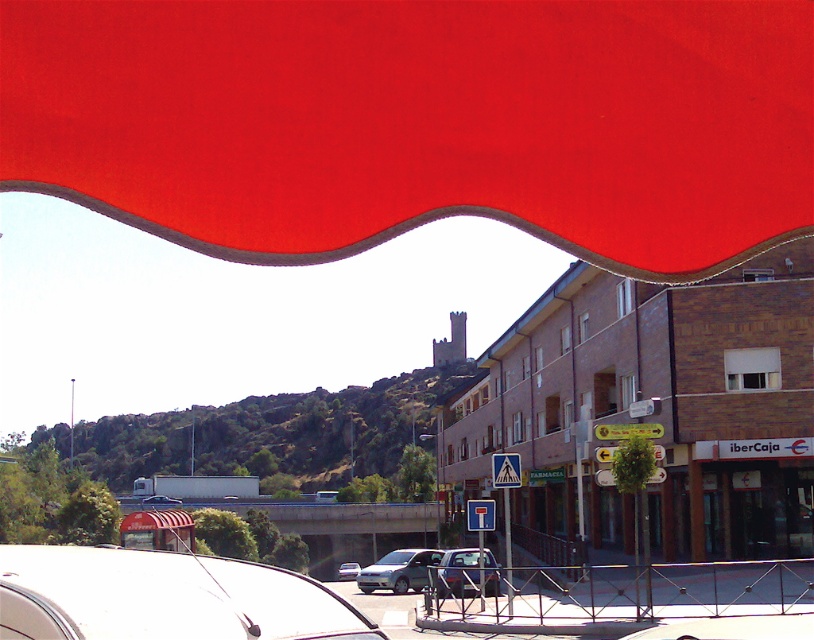
Question: Which point is farther to the camera?

Choices:
 (A) (337, 568)
 (B) (462, 556)

Answer: (A)

Question: Which point is closer to the camera?

Choices:
 (A) white matte car at lower left
 (B) silver metallic sedan at center
 (C) metallic silver car at center
 (D) matte silver van at center

Answer: (A)

Question: Can you confirm if matte red awning at upper center is positioned to the right of silver metallic sedan at center?

Choices:
 (A) no
 (B) yes

Answer: (B)

Question: Considering the relative positions of white matte car at lower left and matte silver van at center in the image provided, where is white matte car at lower left located with respect to matte silver van at center?

Choices:
 (A) right
 (B) left

Answer: (A)

Question: Which object is farther from the camera taking this photo?

Choices:
 (A) white matte car at lower left
 (B) matte red awning at upper center
 (C) metallic silver car at center

Answer: (C)

Question: Is matte red awning at upper center to the right of matte silver van at center from the viewer's perspective?

Choices:
 (A) yes
 (B) no

Answer: (A)